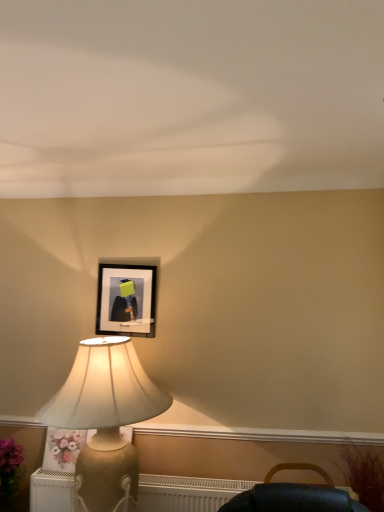
Where is `white textured radiator at lower left`? This screenshot has height=512, width=384. white textured radiator at lower left is located at coordinates (186, 493).

At what (x,y) coordinates should I click in order to perform the action: click on gold textured lamp at left. Please return your answer as a coordinate pair (x, y). The width and height of the screenshot is (384, 512). Looking at the image, I should click on (105, 419).

The image size is (384, 512). What are the coordinates of `floral fabric pillow at lower left` in the screenshot? It's located at (63, 448).

Find the location of a particular element. The width and height of the screenshot is (384, 512). white textured radiator at lower left is located at coordinates (186, 493).

From a real-world perspective, who is located higher, black matte picture frame at upper center or white textured radiator at lower left?

black matte picture frame at upper center, from a real-world perspective.

Which of these two, black matte picture frame at upper center or white textured radiator at lower left, is wider?

white textured radiator at lower left is wider.

Which of these two, black matte picture frame at upper center or white textured radiator at lower left, stands shorter?

white textured radiator at lower left.

Which point is more forward, (65, 498) or (107, 334)?

The point (65, 498) is closer to the camera.

How much distance is there between white textured radiator at lower left and black matte picture frame at upper center?

They are 89.79 centimeters apart.

Which object is positioned more to the left, white textured radiator at lower left or black matte picture frame at upper center?

black matte picture frame at upper center.

From the image's perspective, is white textured radiator at lower left located beneath black matte picture frame at upper center?

Correct, white textured radiator at lower left appears lower than black matte picture frame at upper center in the image.

Could you tell me if gold textured lamp at left is turned towards floral fabric pillow at lower left?

No.

Does gold textured lamp at left have a lesser height compared to floral fabric pillow at lower left?

No.

Considering the positions of objects gold textured lamp at left and floral fabric pillow at lower left in the image provided, who is behind, gold textured lamp at left or floral fabric pillow at lower left?

floral fabric pillow at lower left is behind.

Is black matte picture frame at upper center spatially inside floral fabric pillow at lower left, or outside of it?

black matte picture frame at upper center is not inside floral fabric pillow at lower left, it's outside.

In order to click on picture frame above the floral fabric pillow at lower left (from the image's perspective) in this screenshot , I will do `click(126, 298)`.

From the image's perspective, between black matte picture frame at upper center and floral fabric pillow at lower left, which one is located above?

black matte picture frame at upper center.

Which is more to the left, black matte picture frame at upper center or floral fabric pillow at lower left?

floral fabric pillow at lower left is more to the left.

Is white textured radiator at lower left taller than gold textured lamp at left?

Incorrect, the height of white textured radiator at lower left is not larger of that of gold textured lamp at left.

You are a GUI agent. You are given a task and a screenshot of the screen. Output one action in this format:
    pyautogui.click(x=<x>, y=<y>)
    Task: Click on the radiator that is behind the gold textured lamp at left
    
    Given the screenshot: What is the action you would take?
    pyautogui.click(x=186, y=493)

Is white textured radiator at lower left facing away from gold textured lamp at left?

Yes, white textured radiator at lower left's orientation is away from gold textured lamp at left.

What's the angular difference between white textured radiator at lower left and gold textured lamp at left's facing directions?

The angular difference between white textured radiator at lower left and gold textured lamp at left is 0.585 degrees.

Is black matte picture frame at upper center taller or shorter than gold textured lamp at left?

In the image, black matte picture frame at upper center appears to be shorter than gold textured lamp at left.

Which object is further away from the camera taking this photo, black matte picture frame at upper center or gold textured lamp at left?

black matte picture frame at upper center is further from the camera.

How much distance is there between black matte picture frame at upper center and gold textured lamp at left?

black matte picture frame at upper center and gold textured lamp at left are 17.26 inches apart.

How many degrees apart are the facing directions of black matte picture frame at upper center and gold textured lamp at left?

The angular difference between black matte picture frame at upper center and gold textured lamp at left is 0.0118 degrees.

The height and width of the screenshot is (512, 384). What are the coordinates of `lamp above the floral fabric pillow at lower left (from a real-world perspective)` in the screenshot? It's located at (105, 419).

Which object is positioned more to the right, floral fabric pillow at lower left or gold textured lamp at left?

Positioned to the right is gold textured lamp at left.

Can you see floral fabric pillow at lower left touching gold textured lamp at left?

No, floral fabric pillow at lower left is not making contact with gold textured lamp at left.

I want to click on radiator below the black matte picture frame at upper center (from a real-world perspective), so click(x=186, y=493).

Image resolution: width=384 pixels, height=512 pixels. Find the location of `picture frame above the white textured radiator at lower left (from the image's perspective)`. picture frame above the white textured radiator at lower left (from the image's perspective) is located at coordinates (126, 298).

When comparing their distances from floral fabric pillow at lower left, does white textured radiator at lower left or gold textured lamp at left seem further?

The object further to floral fabric pillow at lower left is gold textured lamp at left.

From the picture: Estimate the real-world distances between objects in this image. Which object is closer to gold textured lamp at left, black matte picture frame at upper center or white textured radiator at lower left?

The object closer to gold textured lamp at left is black matte picture frame at upper center.

Looking at the image, which one is located further to gold textured lamp at left, black matte picture frame at upper center or floral fabric pillow at lower left?

floral fabric pillow at lower left lies further to gold textured lamp at left than the other object.

From the image, which object appears to be nearer to white textured radiator at lower left, black matte picture frame at upper center or floral fabric pillow at lower left?

floral fabric pillow at lower left is positioned closer to the anchor white textured radiator at lower left.

From the image, which object appears to be farther from floral fabric pillow at lower left, black matte picture frame at upper center or white textured radiator at lower left?

black matte picture frame at upper center.

When comparing their distances from black matte picture frame at upper center, does white textured radiator at lower left or floral fabric pillow at lower left seem further?

white textured radiator at lower left lies further to black matte picture frame at upper center than the other object.

Which object lies nearer to the anchor point white textured radiator at lower left, floral fabric pillow at lower left or black matte picture frame at upper center?

floral fabric pillow at lower left is positioned closer to the anchor white textured radiator at lower left.

Based on their spatial positions, is white textured radiator at lower left or gold textured lamp at left further from black matte picture frame at upper center?

white textured radiator at lower left is further to black matte picture frame at upper center.

Where is `radiator located between gold textured lamp at left and floral fabric pillow at lower left in the depth direction`? This screenshot has height=512, width=384. radiator located between gold textured lamp at left and floral fabric pillow at lower left in the depth direction is located at coordinates (186, 493).

Image resolution: width=384 pixels, height=512 pixels. Find the location of `lamp between black matte picture frame at upper center and floral fabric pillow at lower left in the vertical direction`. lamp between black matte picture frame at upper center and floral fabric pillow at lower left in the vertical direction is located at coordinates (105, 419).

At what (x,y) coordinates should I click in order to perform the action: click on lamp between black matte picture frame at upper center and white textured radiator at lower left in the vertical direction. Please return your answer as a coordinate pair (x, y). This screenshot has width=384, height=512. Looking at the image, I should click on (105, 419).

This screenshot has height=512, width=384. In order to click on flower between black matte picture frame at upper center and white textured radiator at lower left in the up-down direction in this screenshot , I will do `click(63, 448)`.